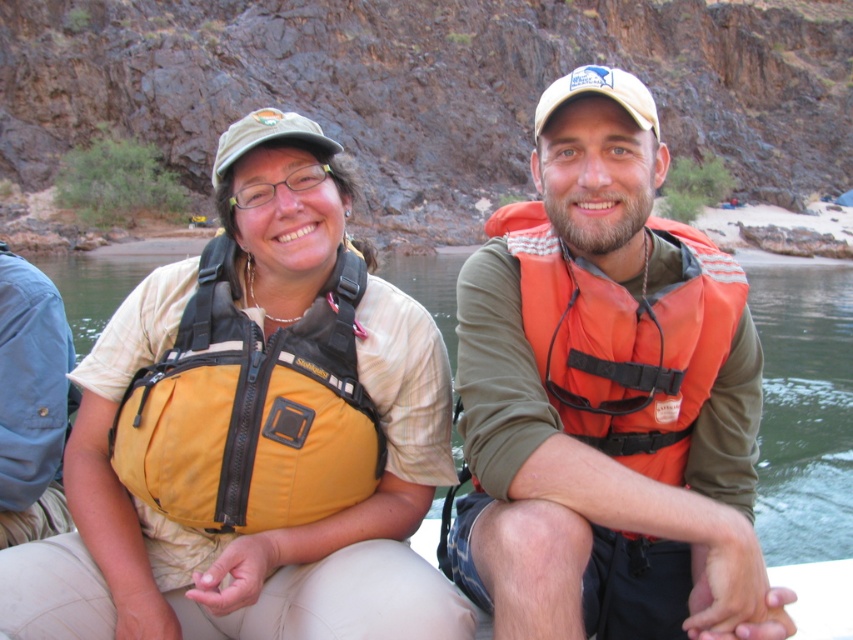
Question: Considering the relative positions of yellow fabric life jacket at left and yellow fabric life vest at left in the image provided, where is yellow fabric life jacket at left located with respect to yellow fabric life vest at left?

Choices:
 (A) left
 (B) right

Answer: (A)

Question: Does yellow fabric life vest at center have a larger size compared to orange life vest at center?

Choices:
 (A) yes
 (B) no

Answer: (B)

Question: Which object is the farthest from the orange life vest at center?

Choices:
 (A) orange fabric life jacket at center
 (B) yellow fabric life vest at left
 (C) yellow fabric life vest at center
 (D) yellow fabric life jacket at left

Answer: (B)

Question: Among these points, which one is farthest from the camera?

Choices:
 (A) (85, 273)
 (B) (647, 397)

Answer: (A)

Question: Does yellow fabric life vest at center have a larger size compared to orange fabric life jacket at center?

Choices:
 (A) no
 (B) yes

Answer: (B)

Question: Which point appears closest to the camera in this image?

Choices:
 (A) (234, 314)
 (B) (837, 364)

Answer: (A)